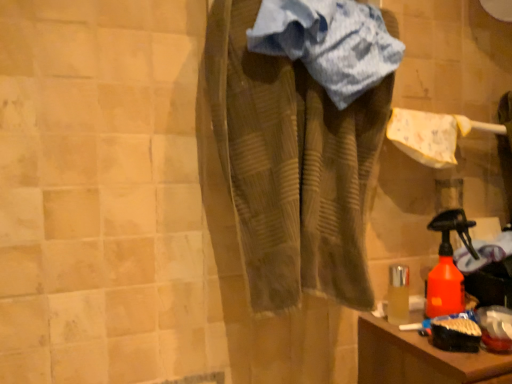
Question: Considering the relative sizes of brown textured towel at center and orange matte spray bottle at lower right in the image provided, is brown textured towel at center shorter than orange matte spray bottle at lower right?

Choices:
 (A) yes
 (B) no

Answer: (B)

Question: Can you confirm if brown textured towel at center is smaller than orange matte spray bottle at lower right?

Choices:
 (A) yes
 (B) no

Answer: (B)

Question: Would you say orange matte spray bottle at lower right is part of brown textured towel at center's contents?

Choices:
 (A) yes
 (B) no

Answer: (B)

Question: Considering the relative positions of brown textured towel at center and orange matte spray bottle at lower right in the image provided, is brown textured towel at center to the right of orange matte spray bottle at lower right from the viewer's perspective?

Choices:
 (A) no
 (B) yes

Answer: (A)

Question: Can you confirm if brown textured towel at center is positioned to the left of orange matte spray bottle at lower right?

Choices:
 (A) no
 (B) yes

Answer: (B)

Question: Does point (265, 28) appear closer or farther from the camera than point (445, 301)?

Choices:
 (A) farther
 (B) closer

Answer: (B)

Question: Looking at the image, does blue striped towel at center seem bigger or smaller compared to orange matte spray bottle at lower right?

Choices:
 (A) big
 (B) small

Answer: (A)

Question: From the image's perspective, is blue striped towel at center above or below orange matte spray bottle at lower right?

Choices:
 (A) below
 (B) above

Answer: (B)

Question: Considering their positions, is blue striped towel at center located in front of or behind orange matte spray bottle at lower right?

Choices:
 (A) front
 (B) behind

Answer: (A)

Question: From the image's perspective, is orange matte spray bottle at lower right above or below blue striped towel at center?

Choices:
 (A) above
 (B) below

Answer: (B)

Question: Which is correct: orange matte spray bottle at lower right is inside blue striped towel at center, or outside of it?

Choices:
 (A) inside
 (B) outside

Answer: (B)

Question: In the image, is orange matte spray bottle at lower right on the left side or the right side of blue striped towel at center?

Choices:
 (A) left
 (B) right

Answer: (B)

Question: From a real-world perspective, is orange matte spray bottle at lower right positioned above or below blue striped towel at center?

Choices:
 (A) below
 (B) above

Answer: (A)

Question: From a real-world perspective, is brown textured towel at center positioned above or below blue striped towel at center?

Choices:
 (A) below
 (B) above

Answer: (A)

Question: Would you say brown textured towel at center is to the left or to the right of blue striped towel at center in the picture?

Choices:
 (A) left
 (B) right

Answer: (B)